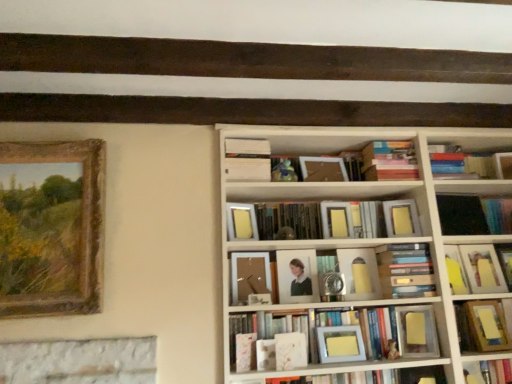
Identify the location of yellow paper at upper right, which is counted as the 6th book, starting from the top. (474, 269).

Locate an element on the screen. The image size is (512, 384). matte white photo frame at center, which is the 4th paperback book from bottom to top is located at coordinates (323, 169).

Image resolution: width=512 pixels, height=384 pixels. Find the location of `hardcover book at center, positioned as the 5th book in top-to-bottom order`. hardcover book at center, positioned as the 5th book in top-to-bottom order is located at coordinates coord(405,270).

Which object is wider, matte yellow picture frame at center, which is the first picture frame in right-to-left order, or white wooden bookcase at upper right?

white wooden bookcase at upper right is wider.

In the scene shown: From a real-world perspective, is matte yellow picture frame at center, the fourth picture frame when ordered from left to right, over white wooden bookcase at upper right?

No, from a real-world perspective, matte yellow picture frame at center, the fourth picture frame when ordered from left to right, is not over white wooden bookcase at upper right

Could you tell me if matte yellow picture frame at center, the fourth picture frame when ordered from left to right, is facing white wooden bookcase at upper right?

Yes, matte yellow picture frame at center, the fourth picture frame when ordered from left to right, faces towards white wooden bookcase at upper right.

Can you confirm if matte yellow picture frame at center, which is the first picture frame in right-to-left order, is taller than white wooden bookcase at upper right?

No.

Is the depth of hardcover book at center, the 10th book when ordered from bottom to top, greater than that of white matte book at center, which is counted as the ninth book, starting from the bottom?

That is True.

How different are the orientations of hardcover book at center, the 10th book when ordered from bottom to top, and white matte book at center, which is counted as the ninth book, starting from the bottom, in degrees?

1.55 degrees separate the facing orientations of hardcover book at center, the 10th book when ordered from bottom to top, and white matte book at center, which is counted as the ninth book, starting from the bottom.

From the image's perspective, which is below, hardcover book at center, acting as the first book starting from the top, or white matte book at center, which is counted as the ninth book, starting from the bottom?

white matte book at center, which is counted as the ninth book, starting from the bottom, from the image's perspective.

Considering the relative sizes of hardcover book at center, the 10th book when ordered from bottom to top, and white matte book at center, the 2th book viewed from the top, in the image provided, is hardcover book at center, the 10th book when ordered from bottom to top, wider than white matte book at center, the 2th book viewed from the top,?

In fact, hardcover book at center, the 10th book when ordered from bottom to top, might be narrower than white matte book at center, the 2th book viewed from the top.

Is matte white frame at center, placed as the third book when sorted from bottom to top, not near matte wooden picture frame at center, marked as the third picture frame in a right-to-left arrangement?

No, there isn't a large distance between matte white frame at center, placed as the third book when sorted from bottom to top, and matte wooden picture frame at center, marked as the third picture frame in a right-to-left arrangement.

Is matte white frame at center, placed as the third book when sorted from bottom to top, shorter than matte wooden picture frame at center, marked as the third picture frame in a right-to-left arrangement?

Yes, matte white frame at center, placed as the third book when sorted from bottom to top, is shorter than matte wooden picture frame at center, marked as the third picture frame in a right-to-left arrangement.

Find the location of a particular element. The height and width of the screenshot is (384, 512). the 1st book to the right of the matte wooden picture frame at center, the 2th picture frame when ordered from left to right, starting your count from the anchor is located at coordinates (345, 329).

Does point (402, 341) come closer to viewer compared to point (253, 258)?

Yes, it is in front of point (253, 258).

Considering the sizes of objects matte yellow paper at center right, the first paperback book from the right, and yellow paper at upper right, the fifth book positioned from the bottom, in the image provided, who is taller, matte yellow paper at center right, the first paperback book from the right, or yellow paper at upper right, the fifth book positioned from the bottom,?

yellow paper at upper right, the fifth book positioned from the bottom, is taller.

From a real-world perspective, who is located lower, matte yellow paper at center right, which is counted as the 4th paperback book, starting from the left, or yellow paper at upper right, which is counted as the 6th book, starting from the top?

matte yellow paper at center right, which is counted as the 4th paperback book, starting from the left, from a real-world perspective.

Between matte yellow paper at center right, arranged as the 1th paperback book when ordered from the bottom, and yellow paper at upper right, the fifth book positioned from the bottom, which one has smaller width?

matte yellow paper at center right, arranged as the 1th paperback book when ordered from the bottom, is thinner.

From the picture: Is matte yellow paper at center right, which is counted as the 4th paperback book, starting from the left, further to the viewer compared to yellow paper at upper right, which is counted as the 6th book, starting from the top?

No, it is not.

Which of these two, matte yellow paper at center, the 1th paperback book in the left-to-right sequence, or gold-framed painting at left, which is the 4th picture frame from right to left, stands shorter?

matte yellow paper at center, the 1th paperback book in the left-to-right sequence.

Would you say matte yellow paper at center, which ranks as the 3th paperback book in top-to-bottom order, is inside or outside gold-framed painting at left, placed as the first picture frame when sorted from left to right?

matte yellow paper at center, which ranks as the 3th paperback book in top-to-bottom order, is not inside gold-framed painting at left, placed as the first picture frame when sorted from left to right, it's outside.

Is matte yellow paper at center, the 1th paperback book in the left-to-right sequence, next to gold-framed painting at left, placed as the first picture frame when sorted from left to right, and touching it?

No, matte yellow paper at center, the 1th paperback book in the left-to-right sequence, is not making contact with gold-framed painting at left, placed as the first picture frame when sorted from left to right.

Which point is more distant from viewer, (233, 236) or (58, 284)?

The point (233, 236) is farther.

The height and width of the screenshot is (384, 512). In order to click on paperback book that is the 1st object to the left of the white wooden bookcase at upper right, starting at the anchor in this screenshot , I will do `click(417, 331)`.

Is matte yellow paper at center right, which is counted as the 4th paperback book, starting from the left, facing away from white wooden bookcase at upper right?

Yes.

Consider the image. Which is farther from the camera, (439, 356) or (248, 329)?

Positioned behind is point (248, 329).

Considering their positions, is matte yellow paper at center right, arranged as the 1th paperback book when ordered from the bottom, located in front of or behind white wooden bookcase at upper right?

In the image, matte yellow paper at center right, arranged as the 1th paperback book when ordered from the bottom, appears behind white wooden bookcase at upper right.

Is gold-framed painting at left, placed as the first picture frame when sorted from left to right, taller or shorter than yellow matte paper at center, acting as the third paperback book starting from the bottom?

gold-framed painting at left, placed as the first picture frame when sorted from left to right, is taller than yellow matte paper at center, acting as the third paperback book starting from the bottom.

Is gold-framed painting at left, which is the 4th picture frame from right to left, bigger than yellow matte paper at center, acting as the third paperback book starting from the bottom?

Yes.

Is point (20, 182) in front of point (405, 206)?

Yes, point (20, 182) is closer to viewer.

Which object is closer to the camera taking this photo, gold-framed painting at left, which is the 4th picture frame from right to left, or yellow matte paper at center, acting as the third paperback book starting from the bottom?

gold-framed painting at left, which is the 4th picture frame from right to left, is more forward.

Where is `the 3rd picture frame directly beneath the white wooden bookcase at upper right (from a real-world perspective)`? the 3rd picture frame directly beneath the white wooden bookcase at upper right (from a real-world perspective) is located at coordinates pos(340,344).

Which book is the 4th one when counting from the right side of the white matte book at center, the 2th book viewed from the top? Please provide its 2D coordinates.

[(389, 161)]

When comparing their distances from hardcover books at center, the 4th book in the top-to-bottom sequence, does matte wooden picture frame at center, marked as the third picture frame in a right-to-left arrangement, or white matte book at center, the 2th book viewed from the top, seem further?

white matte book at center, the 2th book viewed from the top.

Which object lies further to the anchor point matte yellow picture frame at center, the fourth picture frame when ordered from left to right, matte yellow paper at center, the second paperback book in the bottom-to-top sequence, or hardcover book at center, acting as the first book starting from the top?

Among the two, hardcover book at center, acting as the first book starting from the top, is located further to matte yellow picture frame at center, the fourth picture frame when ordered from left to right.

Looking at the image, which one is located further to black matte book at right, the 8th book when ordered from bottom to top, yellow paper at upper right, which is counted as the 6th book, starting from the top, or hardcover book at lower right, placed as the tenth book when sorted from top to bottom?

hardcover book at lower right, placed as the tenth book when sorted from top to bottom, is positioned further to the anchor black matte book at right, the 8th book when ordered from bottom to top.

Looking at the image, which one is located further to yellow paper at upper right, the fifth book positioned from the bottom, matte white frame at center, which is the 8th book in top-to-bottom order, or matte yellow paper at center, the second paperback book in the bottom-to-top sequence?

matte yellow paper at center, the second paperback book in the bottom-to-top sequence.

Based on their spatial positions, is black matte book at right, acting as the third book starting from the top, or matte yellow picture frame at center, the fourth picture frame when ordered from left to right, further from matte wooden photo frame at center, acting as the second picture frame starting from the right?

black matte book at right, acting as the third book starting from the top, lies further to matte wooden photo frame at center, acting as the second picture frame starting from the right, than the other object.

Based on their spatial positions, is matte white photo frame at center, the 1th paperback book viewed from the top, or yellow matte paper at center, which is the 2th paperback book from right to left, closer to matte wooden photo frame at center, acting as the second picture frame starting from the right?

matte white photo frame at center, the 1th paperback book viewed from the top, lies closer to matte wooden photo frame at center, acting as the second picture frame starting from the right, than the other object.

Estimate the real-world distances between objects in this image. Which object is further from yellow paper at upper right, which is counted as the 6th book, starting from the top, yellow matte paper at center, which is counted as the 2th paperback book, starting from the top, or hardcover books at center, the 4th book in the top-to-bottom sequence?

hardcover books at center, the 4th book in the top-to-bottom sequence, is positioned further to the anchor yellow paper at upper right, which is counted as the 6th book, starting from the top.

When comparing their distances from matte white photo frame at center, the 1th paperback book viewed from the top, does matte white frame at center, which is the 8th book in top-to-bottom order, or hardcover book at center, the ninth book in the top-to-bottom sequence, seem closer?

matte white frame at center, which is the 8th book in top-to-bottom order.

Locate an element on the screen. This screenshot has width=512, height=384. bookcase between hardcover books at center, which appears as the seventh book when ordered from the bottom, and black matte book at right, acting as the third book starting from the top is located at coordinates (355, 249).

At what (x,y) coordinates should I click in order to perform the action: click on picture frame situated between matte wooden photo frame at center, marked as the third picture frame in a left-to-right arrangement, and hardcover book at lower right, which is the first book from bottom to top, from left to right. Please return your answer as a coordinate pair (x, y). Looking at the image, I should click on (340, 344).

At what (x,y) coordinates should I click in order to perform the action: click on book between gold-framed painting at left, placed as the first picture frame when sorted from left to right, and matte wooden photo frame at center, acting as the second picture frame starting from the right. Please return your answer as a coordinate pair (x, y). This screenshot has height=384, width=512. Looking at the image, I should click on (247, 159).

I want to click on bookcase between white matte book at center, which is counted as the ninth book, starting from the bottom, and hardcover book at center, marked as the second book in a bottom-to-top arrangement, from top to bottom, so click(355, 249).